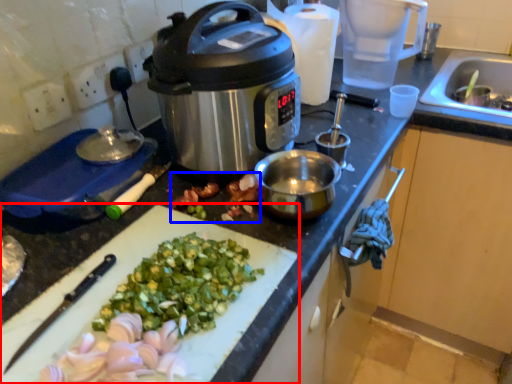
Question: Which object is closer to the camera taking this photo, cutting board (highlighted by a red box) or produce (highlighted by a blue box)?

Choices:
 (A) cutting board
 (B) produce

Answer: (A)